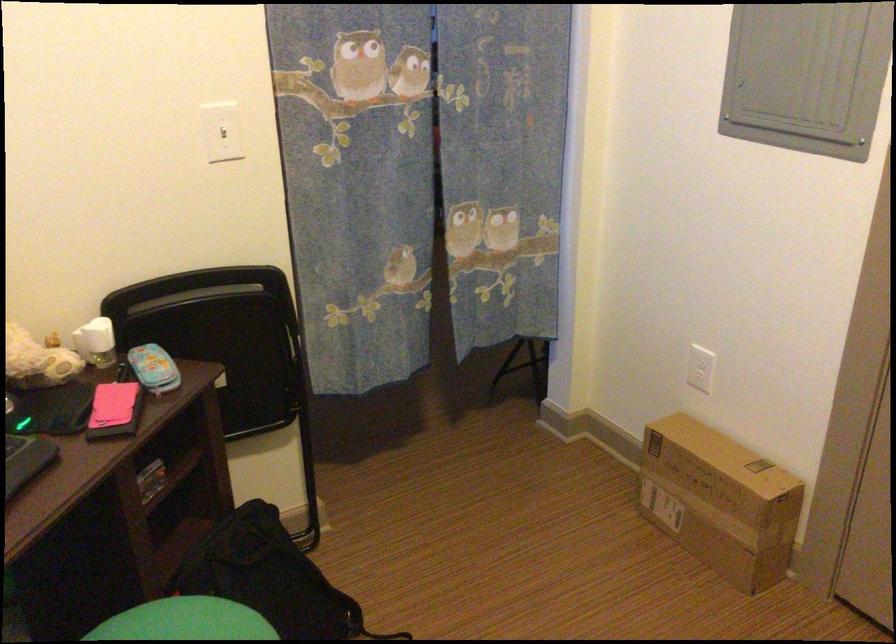
I want to click on black fabric bag, so click(x=270, y=576).